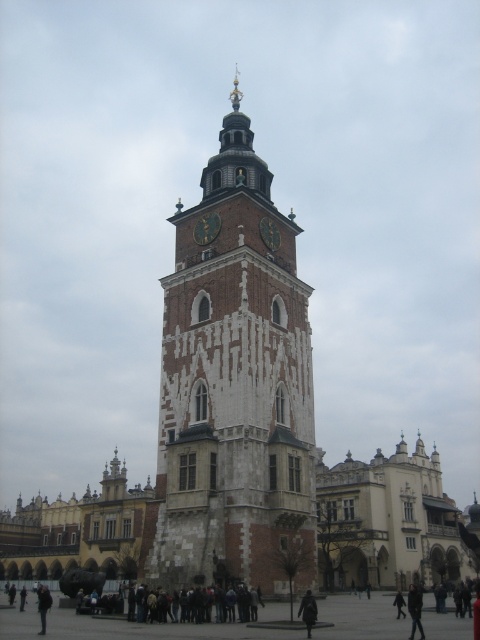
Can you confirm if dark gray jacket at lower center is wider than black leather jacket at lower left?

In fact, dark gray jacket at lower center might be narrower than black leather jacket at lower left.

Looking at this image, is dark gray jacket at lower center taller than black leather jacket at lower left?

Incorrect, dark gray jacket at lower center's height is not larger of black leather jacket at lower left's.

Where is `dark gray jacket at lower center`? dark gray jacket at lower center is located at coordinates (415, 611).

Locate an element on the screen. This screenshot has height=640, width=480. dark gray jacket at lower center is located at coordinates (415, 611).

Does dark gray jacket at lower center have a greater width compared to gold metallic clock at center?

Yes.

Which of these two, dark gray jacket at lower center or gold metallic clock at center, stands shorter?

gold metallic clock at center

This screenshot has height=640, width=480. Find the location of `dark gray jacket at lower center`. dark gray jacket at lower center is located at coordinates (415, 611).

The height and width of the screenshot is (640, 480). What do you see at coordinates (206, 228) in the screenshot?
I see `dark brown wooden clock at center` at bounding box center [206, 228].

Who is higher up, dark brown wooden clock at center or dark gray fabric coat at center?

dark brown wooden clock at center is above.

Identify the location of dark brown wooden clock at center. The image size is (480, 640). (206, 228).